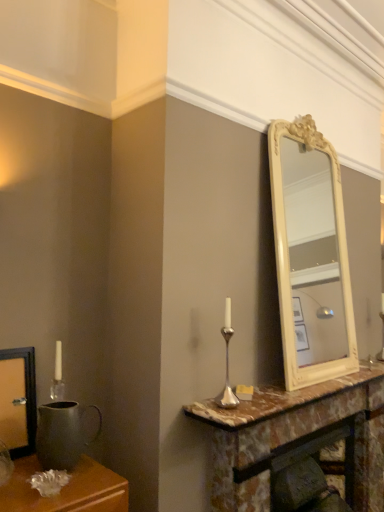
Image resolution: width=384 pixels, height=512 pixels. I want to click on unoccupied space behind silver metallic candle holder at center, so click(x=246, y=396).